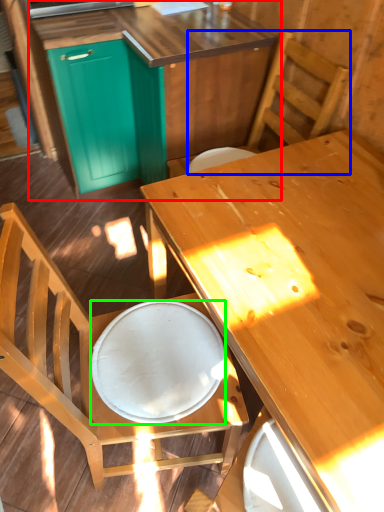
Question: Which object is positioned closest to cabinetry (highlighted by a red box)? Select from chair (highlighted by a blue box) and plate (highlighted by a green box).

Choices:
 (A) chair
 (B) plate

Answer: (A)